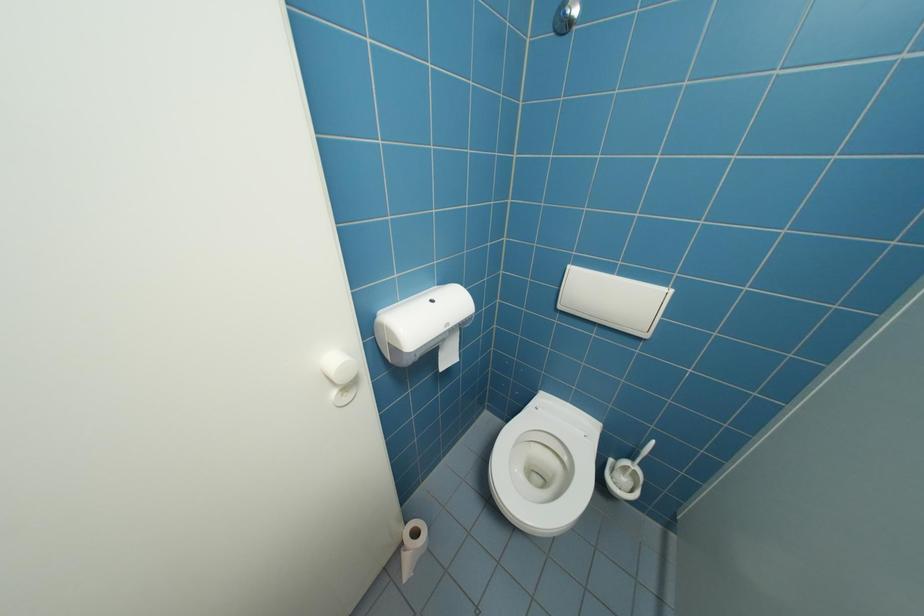
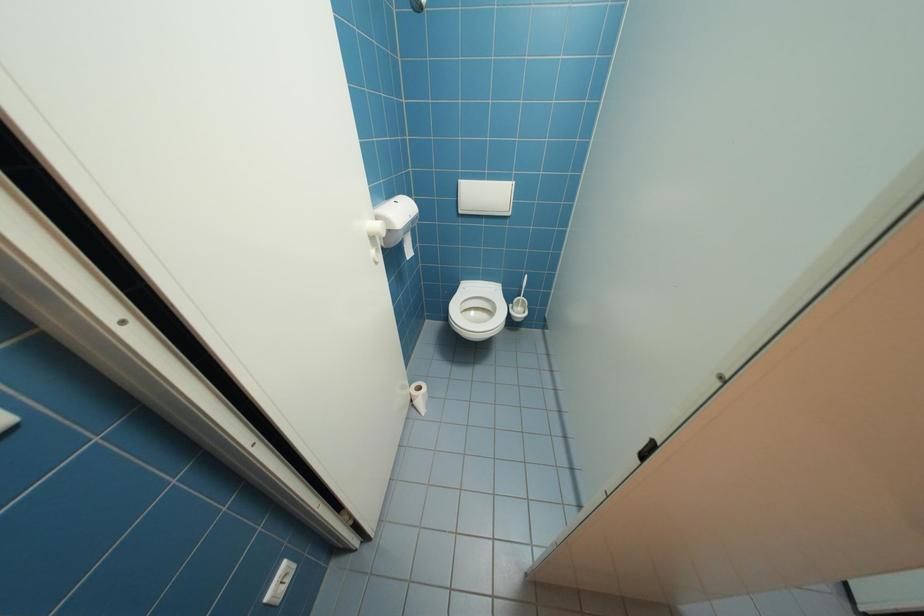
Question: The images are taken continuously from a first-person perspective. In which direction is your viewpoint rotating?

Choices:
 (A) Left
 (B) Right
 (C) Up
 (D) Down

Answer: (B)